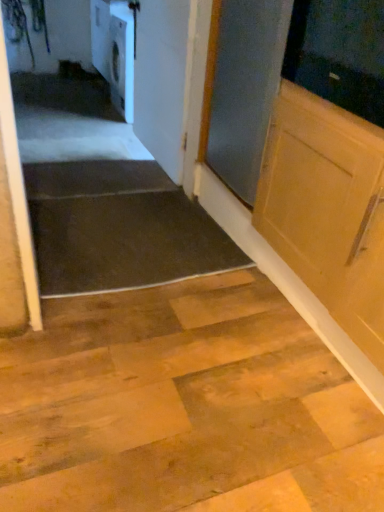
This screenshot has height=512, width=384. In order to click on dark rubber mat at lower left in this screenshot , I will do `click(118, 228)`.

The width and height of the screenshot is (384, 512). What do you see at coordinates (118, 228) in the screenshot? I see `dark rubber mat at lower left` at bounding box center [118, 228].

Where is `white glossy dishwasher at upper left`? The width and height of the screenshot is (384, 512). white glossy dishwasher at upper left is located at coordinates (122, 57).

Image resolution: width=384 pixels, height=512 pixels. In order to click on white glossy door at upper center in this screenshot , I will do `click(163, 80)`.

Is white glossy dishwasher at upper left not near white glossy door at upper center?

white glossy dishwasher at upper left is near white glossy door at upper center, not far away.

What's the angular difference between white glossy dishwasher at upper left and white glossy door at upper center's facing directions?

They differ by 4.63 degrees in their facing directions.

From the image's perspective, would you say white glossy dishwasher at upper left is shown under white glossy door at upper center?

No, from the image's perspective, white glossy dishwasher at upper left is not below white glossy door at upper center.

Considering the sizes of white glossy dishwasher at upper left and white glossy door at upper center in the image, is white glossy dishwasher at upper left wider or thinner than white glossy door at upper center?

white glossy dishwasher at upper left is wider than white glossy door at upper center.

Based on the photo, measure the distance between dark rubber mat at lower left and white glossy dishwasher at upper left.

The distance of dark rubber mat at lower left from white glossy dishwasher at upper left is 1.63 meters.

This screenshot has width=384, height=512. I want to click on dish washer above the dark rubber mat at lower left (from a real-world perspective), so click(122, 57).

Can you see dark rubber mat at lower left touching white glossy dishwasher at upper left?

No, dark rubber mat at lower left is not making contact with white glossy dishwasher at upper left.

Is dark rubber mat at lower left not within white glossy dishwasher at upper left?

Yes.

From the picture: Does white glossy door at upper center have a greater width compared to dark rubber mat at lower left?

No.

From the picture: From a real-world perspective, is white glossy door at upper center above or below dark rubber mat at lower left?

In terms of real-world spatial position, white glossy door at upper center is above dark rubber mat at lower left.

Does point (185, 41) appear closer or farther from the camera than point (134, 200)?

Point (185, 41).

Are white glossy door at upper center and dark rubber mat at lower left beside each other?

No, white glossy door at upper center is not next to dark rubber mat at lower left.

Which is further, [159,76] or [133,109]?

The point [133,109] is behind.

Considering the sizes of objects white glossy door at upper center and white glossy dishwasher at upper left in the image provided, who is bigger, white glossy door at upper center or white glossy dishwasher at upper left?

white glossy dishwasher at upper left is bigger.

Considering the sizes of objects white glossy door at upper center and white glossy dishwasher at upper left in the image provided, who is thinner, white glossy door at upper center or white glossy dishwasher at upper left?

white glossy door at upper center is thinner.

From a real-world perspective, is white glossy door at upper center positioned above or below white glossy dishwasher at upper left?

In terms of real-world spatial position, white glossy door at upper center is above white glossy dishwasher at upper left.

From the picture: From the image's perspective, does white glossy dishwasher at upper left appear lower than dark rubber mat at lower left?

No, from the image's perspective, white glossy dishwasher at upper left is not below dark rubber mat at lower left.

Is white glossy dishwasher at upper left positioned before dark rubber mat at lower left?

No, the depth of white glossy dishwasher at upper left is greater than that of dark rubber mat at lower left.

Where is `dish washer that is above the dark rubber mat at lower left (from a real-world perspective)`? Image resolution: width=384 pixels, height=512 pixels. dish washer that is above the dark rubber mat at lower left (from a real-world perspective) is located at coordinates (122, 57).

Can you confirm if dark rubber mat at lower left is positioned to the right of white glossy door at upper center?

No, dark rubber mat at lower left is not to the right of white glossy door at upper center.

The height and width of the screenshot is (512, 384). I want to click on door behind the dark rubber mat at lower left, so click(163, 80).

Would you say dark rubber mat at lower left is a long distance from white glossy door at upper center?

That's not correct — dark rubber mat at lower left is a little close to white glossy door at upper center.

Does point (89, 216) come farther from viewer compared to point (168, 4)?

That is False.

You are a GUI agent. You are given a task and a screenshot of the screen. Output one action in this format:
    pyautogui.click(x=<x>, y=<y>)
    Task: Click on the dish washer lying on the left of white glossy door at upper center
    This screenshot has height=512, width=384.
    Given the screenshot: What is the action you would take?
    pyautogui.click(x=122, y=57)

You are a GUI agent. You are given a task and a screenshot of the screen. Output one action in this format:
    pyautogui.click(x=<x>, y=<y>)
    Task: Click on the stairwell that is in front of the white glossy dishwasher at upper left
    The image size is (384, 512).
    Given the screenshot: What is the action you would take?
    pyautogui.click(x=118, y=228)

Looking at the image, which one is located closer to white glossy dishwasher at upper left, white glossy door at upper center or dark rubber mat at lower left?

white glossy door at upper center is positioned closer to the anchor white glossy dishwasher at upper left.

Which object lies nearer to the anchor point dark rubber mat at lower left, white glossy dishwasher at upper left or white glossy door at upper center?

Based on the image, white glossy door at upper center appears to be nearer to dark rubber mat at lower left.

Based on their spatial positions, is white glossy door at upper center or white glossy dishwasher at upper left closer to dark rubber mat at lower left?

white glossy door at upper center.

From the picture: Which object lies further to the anchor point white glossy dishwasher at upper left, dark rubber mat at lower left or white glossy door at upper center?

dark rubber mat at lower left lies further to white glossy dishwasher at upper left than the other object.

Considering their positions, is dark rubber mat at lower left positioned closer to white glossy door at upper center than white glossy dishwasher at upper left?

Based on the image, dark rubber mat at lower left appears to be nearer to white glossy door at upper center.

Looking at the image, which one is located further to white glossy door at upper center, white glossy dishwasher at upper left or dark rubber mat at lower left?

white glossy dishwasher at upper left is further to white glossy door at upper center.

Locate an element on the screen. Image resolution: width=384 pixels, height=512 pixels. door located between dark rubber mat at lower left and white glossy dishwasher at upper left in the depth direction is located at coordinates (163, 80).